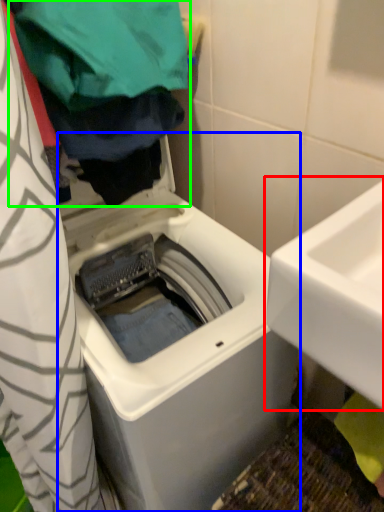
Question: Based on their relative distances, which object is nearer to sink (highlighted by a red box)? Choose from washing machine (highlighted by a blue box) and clothing (highlighted by a green box).

Choices:
 (A) washing machine
 (B) clothing

Answer: (A)